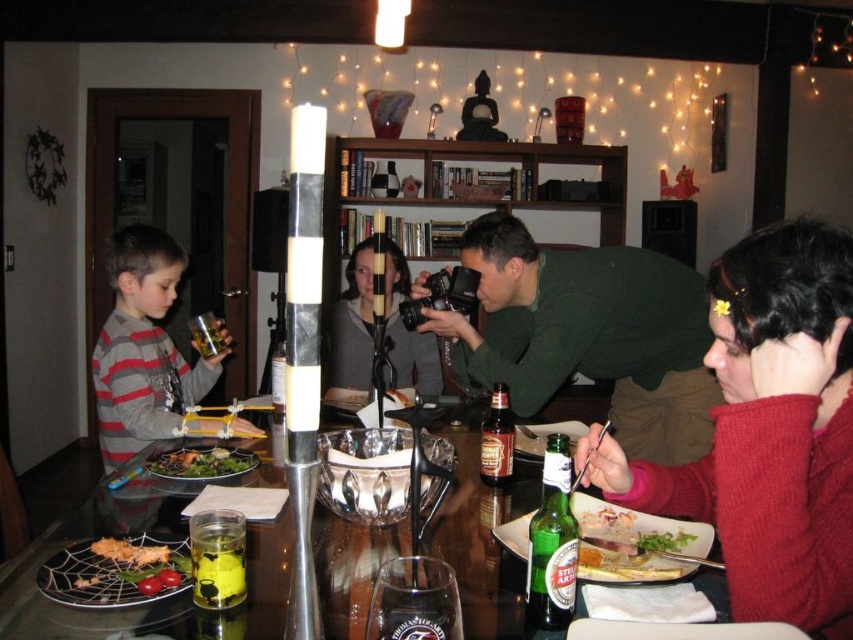
Question: Which is farther from the green matte shirt at center?

Choices:
 (A) striped sweater at left
 (B) green leafy salad at lower right

Answer: (B)

Question: Can you confirm if clear glass bowl at center is positioned above green leafy salad at center?

Choices:
 (A) yes
 (B) no

Answer: (A)

Question: Does striped fabric shirt at left have a lesser width compared to clear glass bowl at center?

Choices:
 (A) yes
 (B) no

Answer: (B)

Question: Which point is closer to the camera?

Choices:
 (A) green leafy salad at center
 (B) striped fabric shirt at left
 (C) glassy clear plate at center

Answer: (C)

Question: Estimate the real-world distances between objects in this image. Which object is closer to the clear glass bowl at center?

Choices:
 (A) green glass bottle at lower right
 (B) green leafy salad at lower right
 (C) green leafy salad at center
 (D) striped fabric shirt at left

Answer: (A)

Question: From the image, what is the correct spatial relationship of clear glass bowl at center in relation to green leafy salad at lower right?

Choices:
 (A) below
 (B) above

Answer: (B)